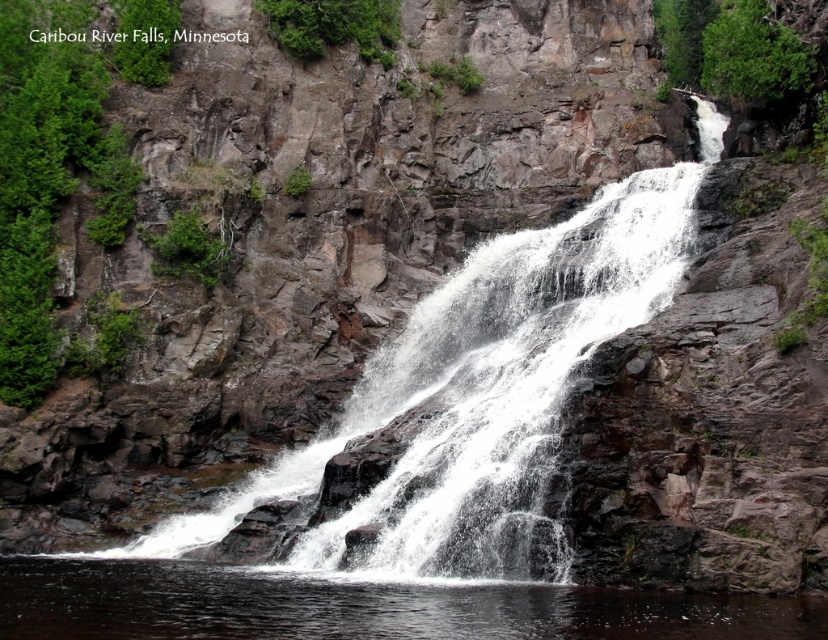
Question: Which object appears closest to the camera in this image?

Choices:
 (A) clear water at center
 (B) white frothy water at center

Answer: (A)

Question: In this image, where is white frothy water at center located relative to clear water at center?

Choices:
 (A) above
 (B) below

Answer: (A)

Question: Can you confirm if white frothy water at center is positioned to the left of clear water at center?

Choices:
 (A) no
 (B) yes

Answer: (A)

Question: Which point is closer to the camera?

Choices:
 (A) click(566, 605)
 (B) click(366, 509)

Answer: (A)

Question: Does white frothy water at center appear over clear water at center?

Choices:
 (A) no
 (B) yes

Answer: (B)